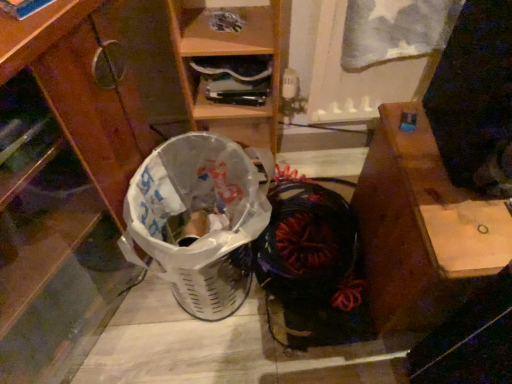
Question: Does wooden desk at right appear on the right side of brushed wood cabinet at lower left?

Choices:
 (A) no
 (B) yes

Answer: (B)

Question: Is wooden desk at right thinner than brushed wood cabinet at lower left?

Choices:
 (A) no
 (B) yes

Answer: (B)

Question: From the image's perspective, is wooden desk at right below brushed wood cabinet at lower left?

Choices:
 (A) no
 (B) yes

Answer: (B)

Question: From a real-world perspective, is wooden desk at right located beneath brushed wood cabinet at lower left?

Choices:
 (A) no
 (B) yes

Answer: (B)

Question: Is wooden desk at right next to brushed wood cabinet at lower left?

Choices:
 (A) yes
 (B) no

Answer: (B)

Question: Is wooden desk at right oriented away from brushed wood cabinet at lower left?

Choices:
 (A) no
 (B) yes

Answer: (A)

Question: Can you confirm if white plastic shopping basket at lower left is positioned to the right of wooden desk at right?

Choices:
 (A) no
 (B) yes

Answer: (A)

Question: Is white plastic shopping basket at lower left located outside wooden desk at right?

Choices:
 (A) no
 (B) yes

Answer: (B)

Question: Is white plastic shopping basket at lower left turned away from wooden desk at right?

Choices:
 (A) yes
 (B) no

Answer: (B)

Question: Does white plastic shopping basket at lower left have a greater height compared to wooden desk at right?

Choices:
 (A) no
 (B) yes

Answer: (A)

Question: Is white plastic shopping basket at lower left far from wooden desk at right?

Choices:
 (A) yes
 (B) no

Answer: (B)

Question: Is wooden desk at right surrounded by white plastic shopping basket at lower left?

Choices:
 (A) yes
 (B) no

Answer: (B)

Question: Does brushed wood cabinet at lower left have a larger size compared to black fabric shoe at center?

Choices:
 (A) no
 (B) yes

Answer: (B)